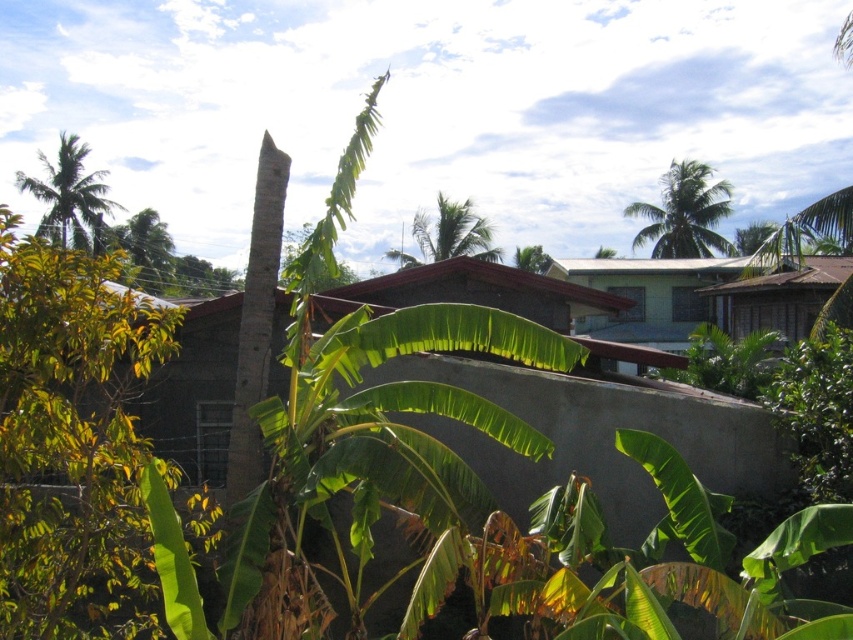
Based on the photo, you are a visitor in this tropical area and want to stay out of the sun. Which object can provide shade from the sun, the brown wooden hut at upper right or the green leafy palm tree at upper right?

The green leafy palm tree at upper right can provide shade from the sun because the brown wooden hut at upper right is positioned under it.

You are an architect designing a new ecofriendly house. You want to ensure your design is narrower than the green leafy palm tree at upper center. Can the brown wooden hut at upper right, which is part of the existing neighborhood, serve as a reference for the width of your new house?

The brown wooden hut at upper right is thinner than the green leafy palm tree at upper center, so yes, using the brown wooden hut at upper right as a reference would ensure your new house is narrower than the green leafy palm tree at upper center.

You are standing in the tropical residential area and want to take a photo of the brown wooden hut at upper right and the green leafy palm tree at upper center. Which object should you point your camera towards first if you want to capture both in the same frame?

The brown wooden hut at upper right is below the green leafy palm tree at upper center, so you should point your camera upwards to include both in the frame.